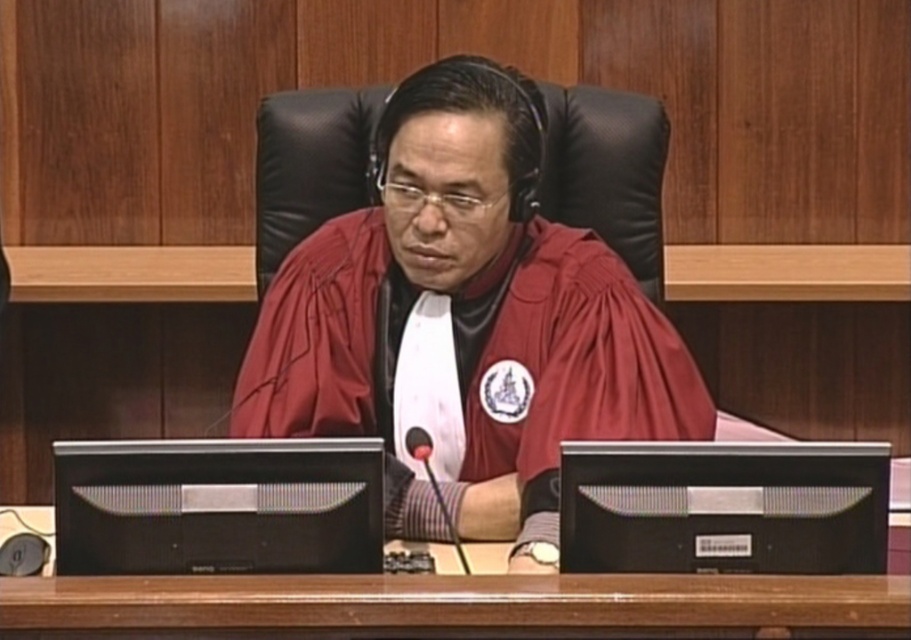
You are a legal assistant who needs to place a 17 inch legal document on the desk between the black matte monitor at center and the black plastic monitor at center. Can you fit it there?

The distance between the black matte monitor at center and the black plastic monitor at center is 16.43 inches. Since the document is 17 inches long, it won generated spatial reasoning question and answer based on the provided information. 1 inch longer than the available space, so it won

You are standing 10 feet away from the desk in the courtroom. There is a point marked at coordinates point (537, 268). Can you reach that point without moving closer than 8 feet to the desk?

The distance of point (537, 268) from viewer is 8.29 feet. Since you are standing 10 feet away from the desk, you can reach that point without moving closer than 8 feet because the point is only 8.29 feet away from you, which is within the 8 feet requirement.